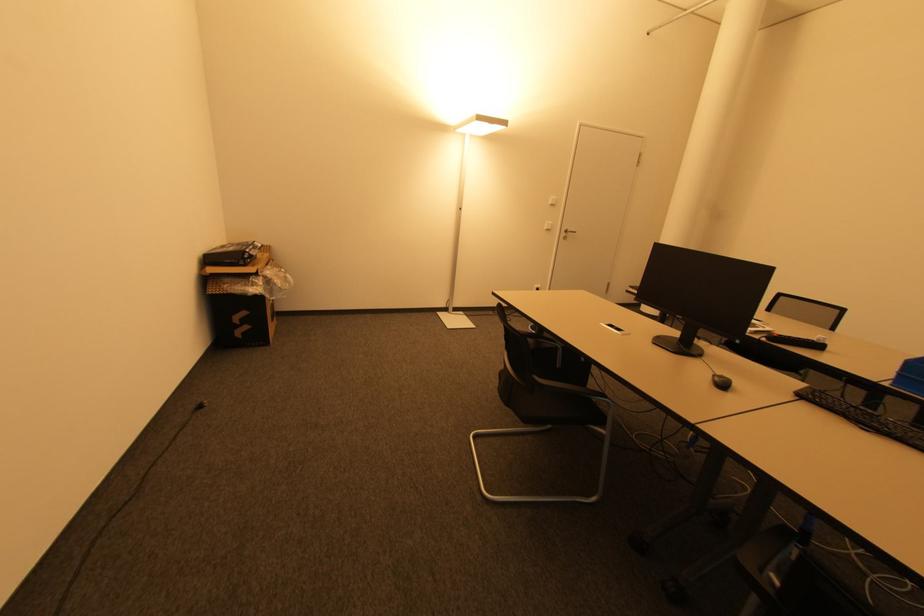
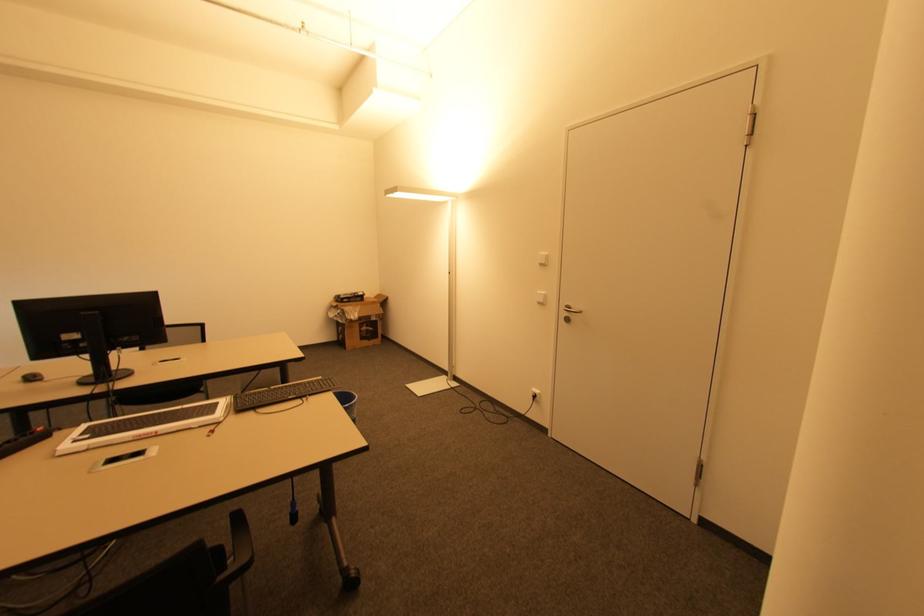
Find the pixel in the second image that matches the point at 553,206 in the first image.

(542, 265)